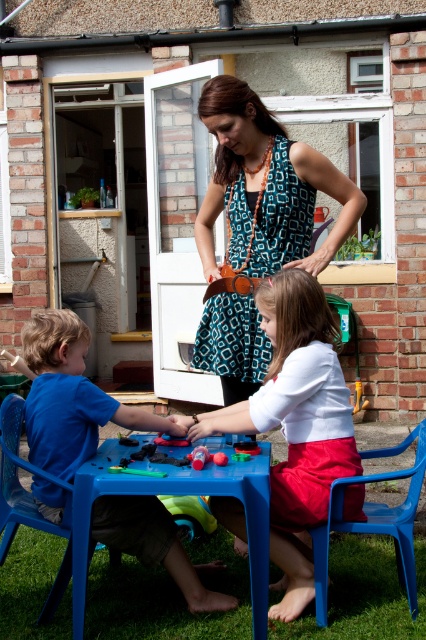
Question: Where is white matte shirt at center located in relation to blue plastic chair at lower center in the image?

Choices:
 (A) below
 (B) above

Answer: (B)

Question: Among these objects, which one is farthest from the camera?

Choices:
 (A) blue plastic boy at lower left
 (B) blue plastic table at center
 (C) white matte shirt at center
 (D) blue plastic chair at lower center

Answer: (C)

Question: Is teal patterned dress at center wider than rubberized plastic toy at center?

Choices:
 (A) no
 (B) yes

Answer: (B)

Question: Is the position of teal patterned dress at center more distant than that of blue plastic toy at lower center?

Choices:
 (A) yes
 (B) no

Answer: (B)

Question: Which point is closer to the camera?

Choices:
 (A) blue plastic table at center
 (B) blue plastic boy at lower left
 (C) blue plastic chair at lower center

Answer: (A)

Question: Which object is positioned closest to the white matte shirt at center?

Choices:
 (A) blue plastic boy at lower left
 (B) blue plastic table at center
 (C) rubberized plastic toy at center

Answer: (C)